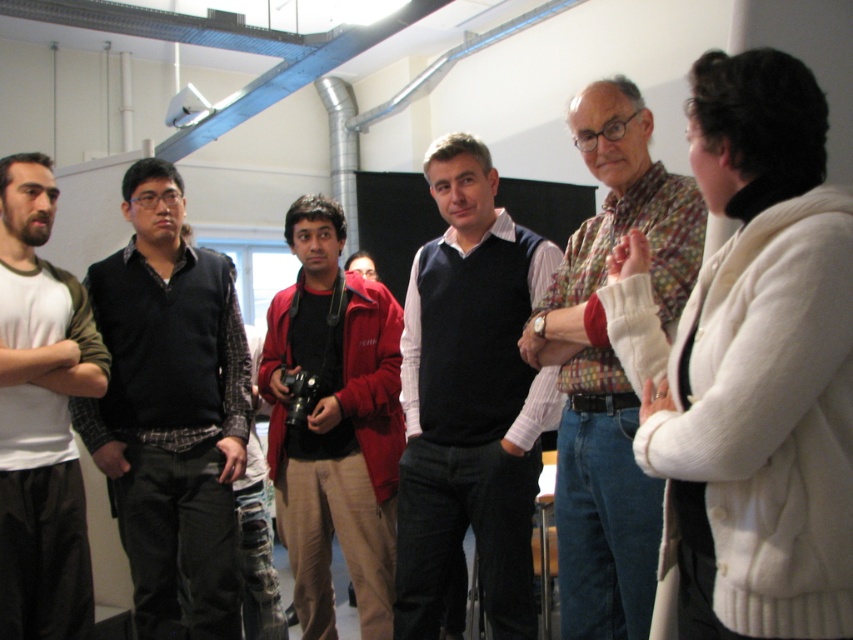
Question: Among these objects, which one is nearest to the camera?

Choices:
 (A) matte white t-shirt at left
 (B) multicolored woven vest at center
 (C) dark blue sweater at center
 (D) red jacket at center

Answer: (B)

Question: Observing the image, what is the correct spatial positioning of dark blue sweater at center in reference to plaid shirt at left?

Choices:
 (A) left
 (B) right

Answer: (B)

Question: Estimate the real-world distances between objects in this image. Which object is farther from the dark blue sweater at center?

Choices:
 (A) red jacket at center
 (B) plaid shirt at left

Answer: (B)

Question: Is plaid shirt at left closer to the viewer compared to multicolored woven vest at center?

Choices:
 (A) no
 (B) yes

Answer: (A)

Question: Which point appears farthest from the camera in this image?

Choices:
 (A) (608, 516)
 (B) (155, 177)

Answer: (B)

Question: Does dark blue sweater at center have a greater width compared to matte white t-shirt at left?

Choices:
 (A) yes
 (B) no

Answer: (A)